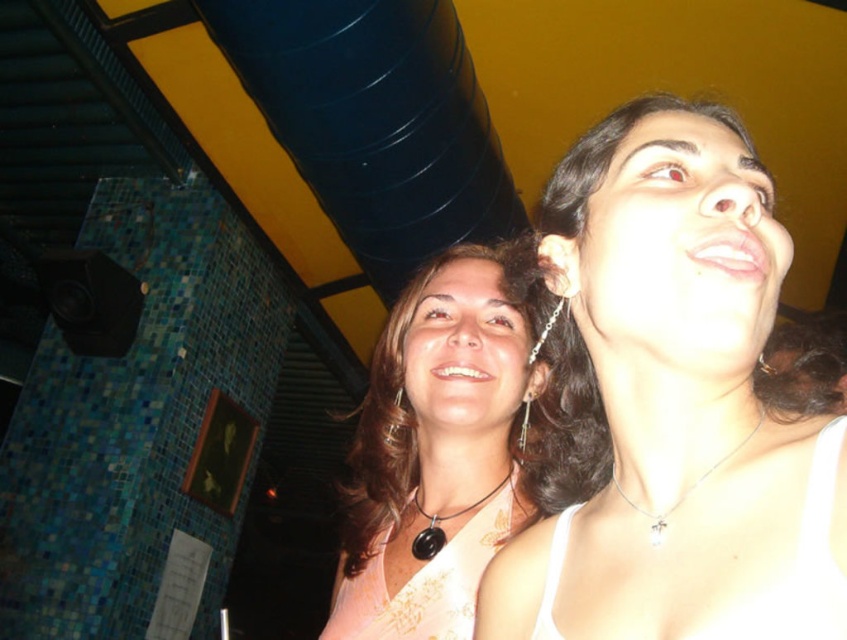
You are trying to decide which necklace to buy as a gift. The silver metallic necklace at upper center and the black leather necklace at center are both in your options. Which one is bigger in size?

The black leather necklace at center is bigger in size compared to the silver metallic necklace at upper center.

You are a photographer trying to capture a closeup shot of the silver metallic necklace at upper center and the black leather necklace at center. Given that your camera has a depth of field that can focus on objects within 16 inches, will both necklaces be in focus?

The silver metallic necklace at upper center is 16.59 inches away from the black leather necklace at center. Since the distance between them exceeds the camera sensor depth of field of 16 inches, the two necklaces will not both be in focus simultaneously.